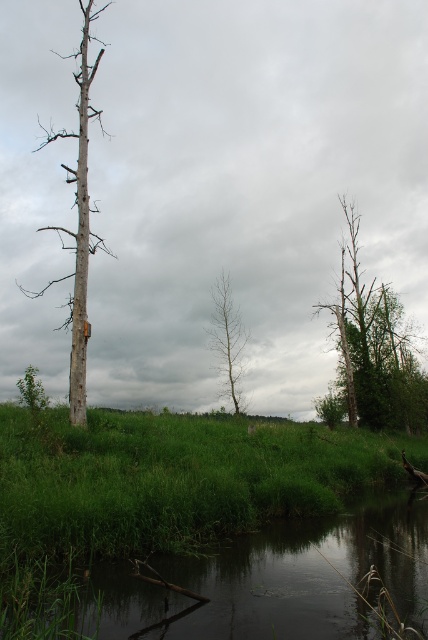
You are an environmental scientist assessing the area. You need to determine which tree, the smooth bark tree at left or the bare wood tree at center, has a greater height for potential habitat studies. Based on the scene, which tree is taller?

The smooth bark tree at left is taller than the bare wood tree at center, making it the better candidate for studying habitats requiring height.